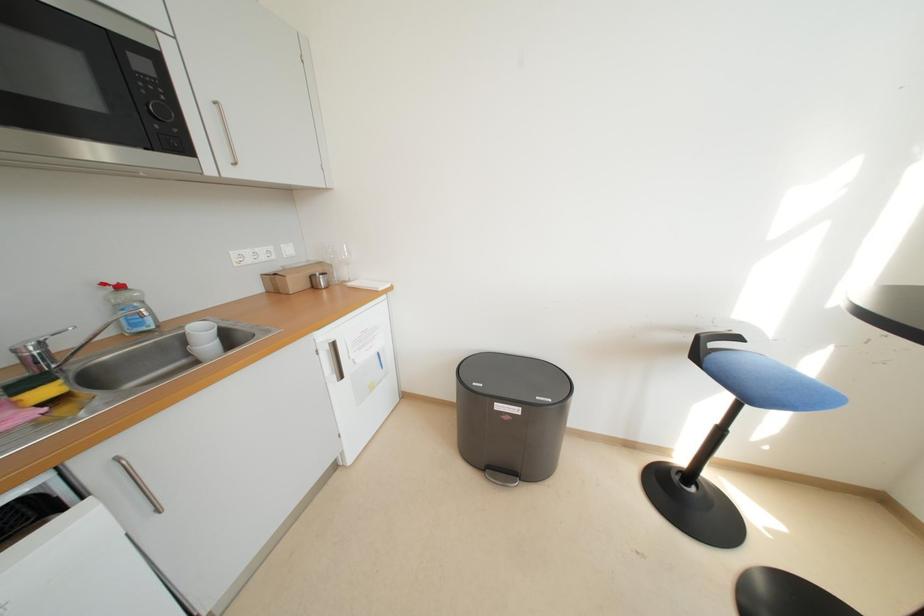
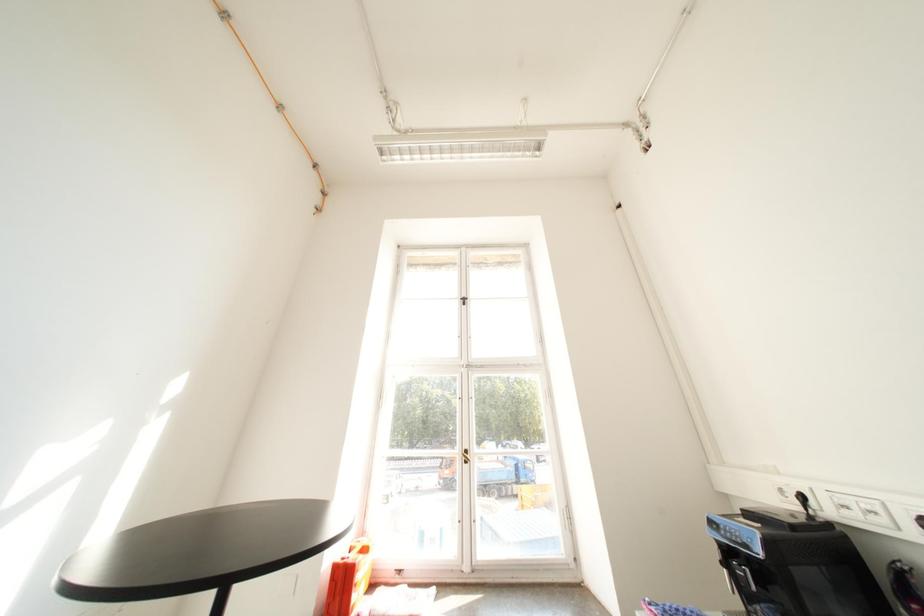
The images are taken continuously from a first-person perspective. In which direction is your viewpoint rotating?

The camera's rotation is toward right-up.